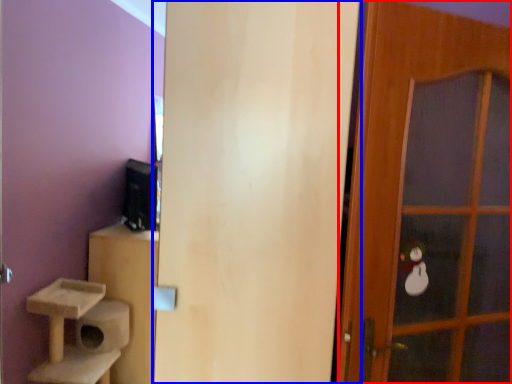
Question: Which object appears closest to the camera in this image, door (highlighted by a red box) or door (highlighted by a blue box)?

Choices:
 (A) door
 (B) door

Answer: (B)